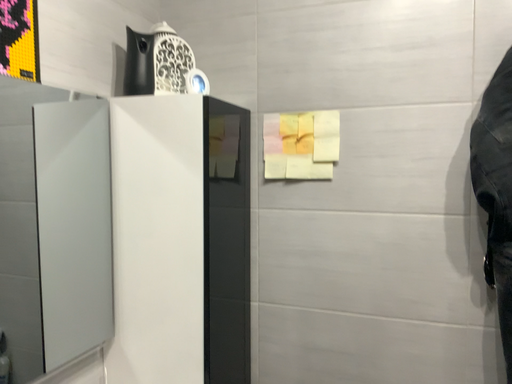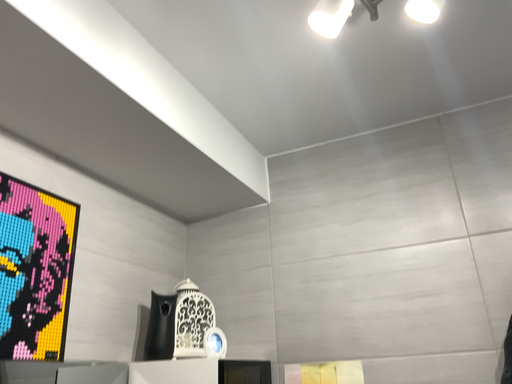
Question: How did the camera likely rotate when shooting the video?

Choices:
 (A) rotated downward
 (B) rotated upward

Answer: (B)